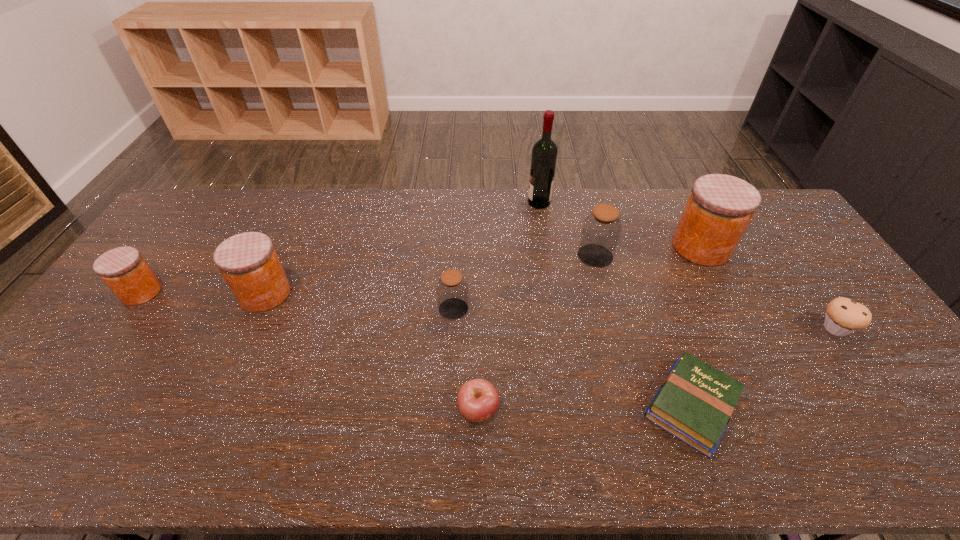
Identify which orange jar is the third closest to the muffin. Please provide its 2D coordinates. Your answer should be formatted as a tuple, i.e. [(x, y)], where the tuple contains the x and y coordinates of a point satisfying the conditions above.

[(123, 269)]

At what (x,y) coordinates should I click in order to perform the action: click on free spot that satisfies the following two spatial constraints: 1. on the front and back of the rightmost object; 2. on the left side of the alcohol. Please return your answer as a coordinate pair (x, y). The image size is (960, 540). Looking at the image, I should click on (559, 328).

At what (x,y) coordinates should I click in order to perform the action: click on vacant area in the image that satisfies the following two spatial constraints: 1. on the back side of the right brown jar; 2. on the front and back of the fifth object from left to right. Please return your answer as a coordinate pair (x, y). Image resolution: width=960 pixels, height=540 pixels. Looking at the image, I should click on (581, 202).

Image resolution: width=960 pixels, height=540 pixels. In order to click on free point that satisfies the following two spatial constraints: 1. on the back side of the farther brown jar; 2. on the left side of the eighth object from right to left in this screenshot , I will do `click(282, 255)`.